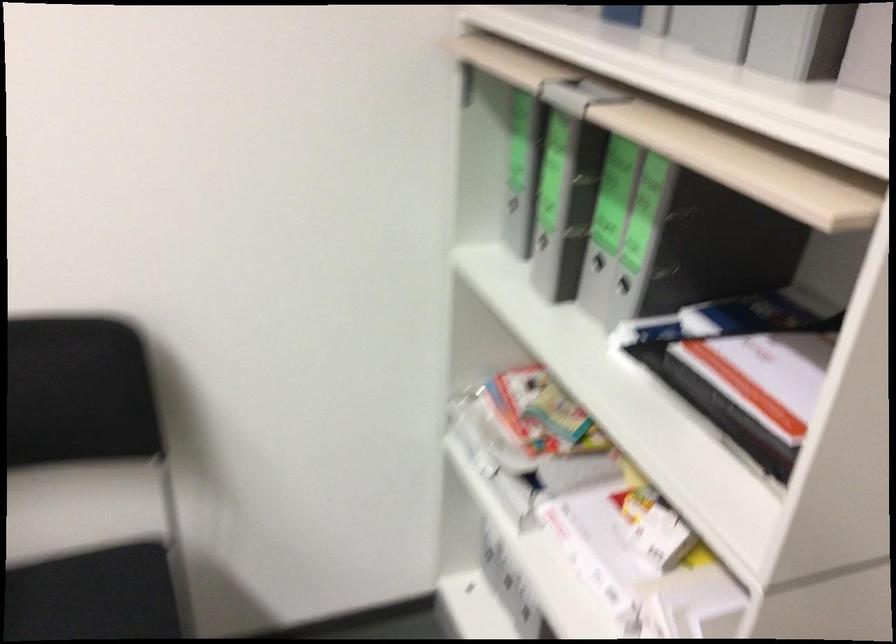
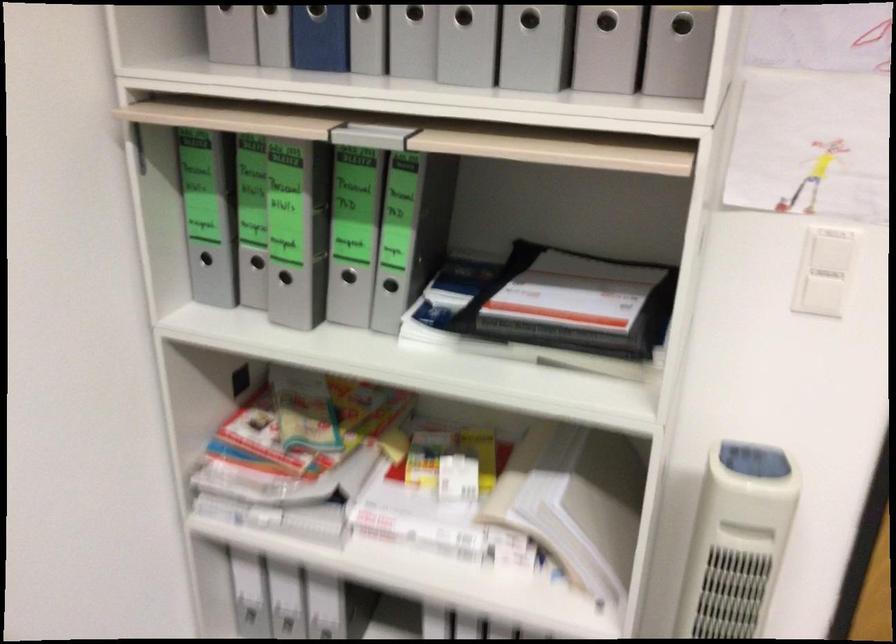
Locate, in the second image, the point that corresponds to [609,261] in the first image.

(348, 276)